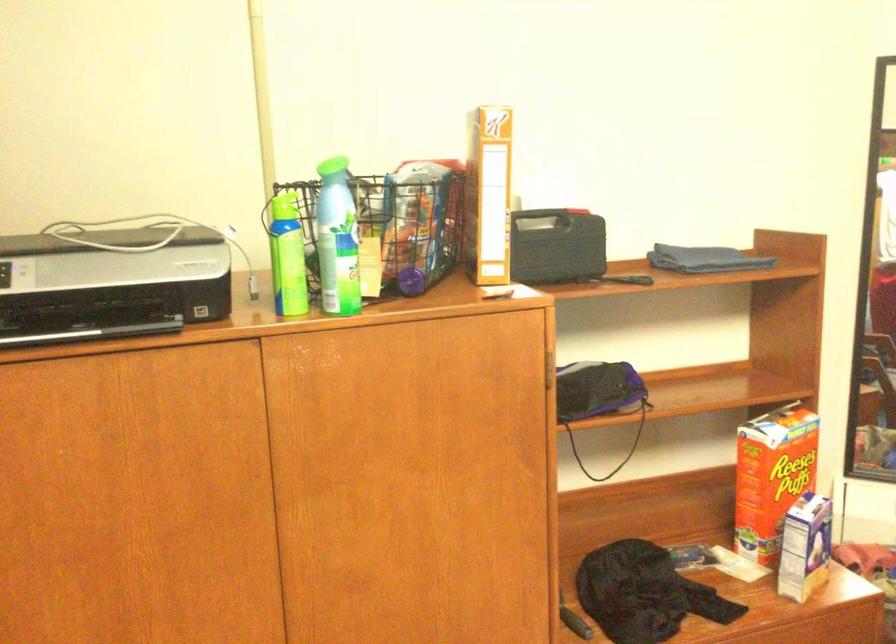
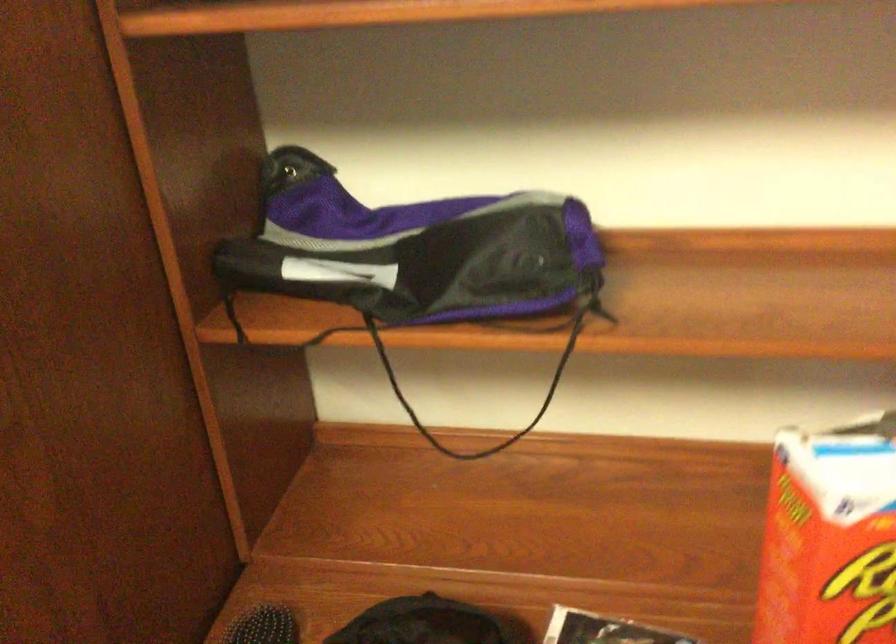
Find the pixel in the second image that matches pixel 782 446 in the first image.

(830, 538)